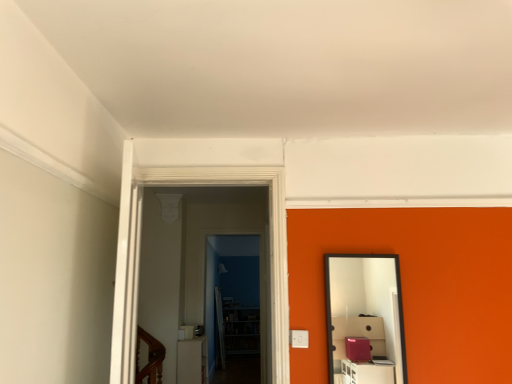
Question: Based on their sizes in the image, would you say black framed mirror at right is bigger or smaller than white glossy light switch at center?

Choices:
 (A) big
 (B) small

Answer: (B)

Question: From their relative heights in the image, would you say black framed mirror at right is taller or shorter than white glossy light switch at center?

Choices:
 (A) short
 (B) tall

Answer: (B)

Question: Estimate the real-world distances between objects in this image. Which object is closer to the black framed mirror at right?

Choices:
 (A) white glossy light switch at center
 (B) transparent glass door at center, acting as the second glass door starting from the front
 (C) transparent glass door at center, positioned as the 1th glass door in front-to-back order

Answer: (C)

Question: Based on their relative distances, which object is nearer to the black framed mirror at right?

Choices:
 (A) transparent glass door at center, positioned as the 1th glass door in front-to-back order
 (B) white glossy light switch at center
 (C) transparent glass door at center, arranged as the first glass door when viewed from the back

Answer: (A)